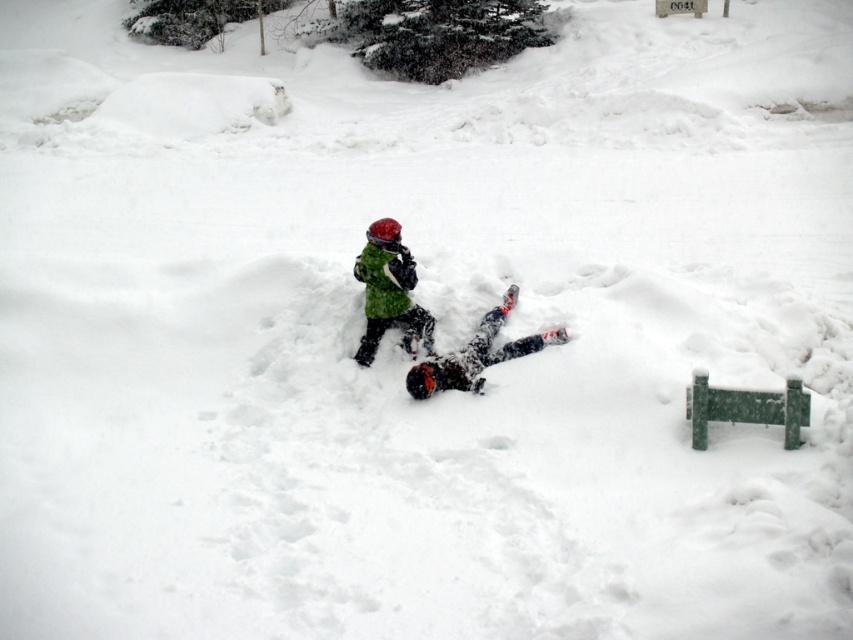
Between green snowsuit at center and green fuzzy jacket at center, which one has more height?

With more height is green snowsuit at center.

Which is in front, point (392, 269) or point (410, 259)?

Point (392, 269) is more forward.

Is point (401, 259) in front of point (395, 288)?

No, (401, 259) is further to viewer.

The image size is (853, 640). In order to click on green snowsuit at center in this screenshot , I will do `click(389, 291)`.

Is dark gray fabric snowboarder at center bigger than green fuzzy jacket at center?

Yes.

Looking at this image, how distant is dark gray fabric snowboarder at center from green fuzzy jacket at center?

A distance of 78.12 centimeters exists between dark gray fabric snowboarder at center and green fuzzy jacket at center.

Is point (434, 388) positioned after point (386, 312)?

No, it is not.

This screenshot has height=640, width=853. Identify the location of dark gray fabric snowboarder at center. (476, 355).

Who is positioned more to the right, green snowsuit at center or dark gray fabric snowboarder at center?

dark gray fabric snowboarder at center

Does green snowsuit at center appear over dark gray fabric snowboarder at center?

Yes, green snowsuit at center is above dark gray fabric snowboarder at center.

Is point (368, 252) positioned before point (438, 388)?

No, (368, 252) is further to viewer.

Where is `green snowsuit at center`? green snowsuit at center is located at coordinates (389, 291).